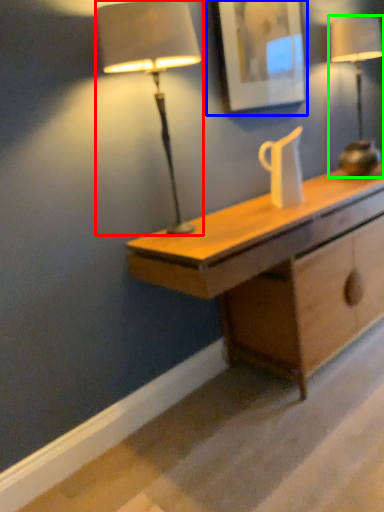
Question: Which object is the closest to the lamp (highlighted by a red box)? Choose among these: picture frame (highlighted by a blue box) or lamp (highlighted by a green box).

Choices:
 (A) picture frame
 (B) lamp

Answer: (A)